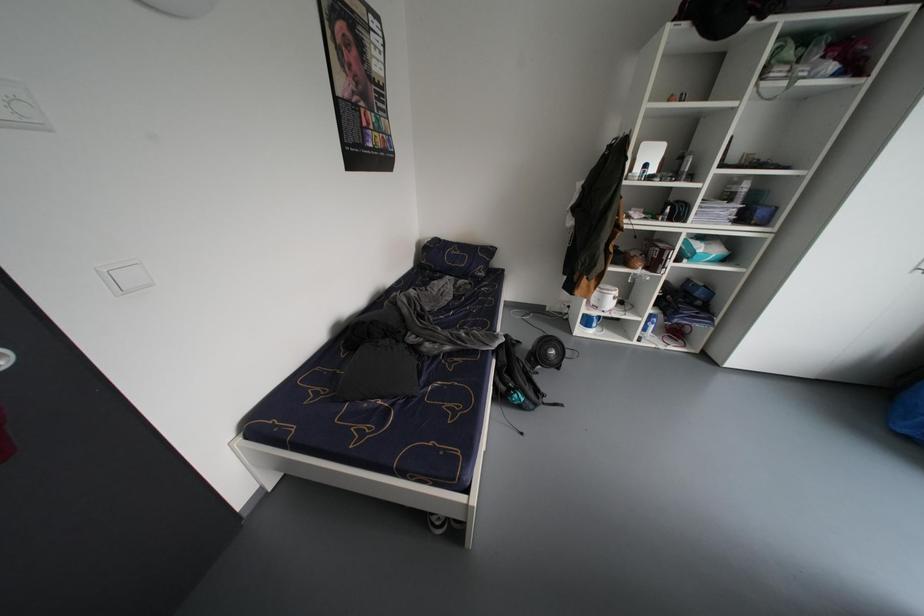
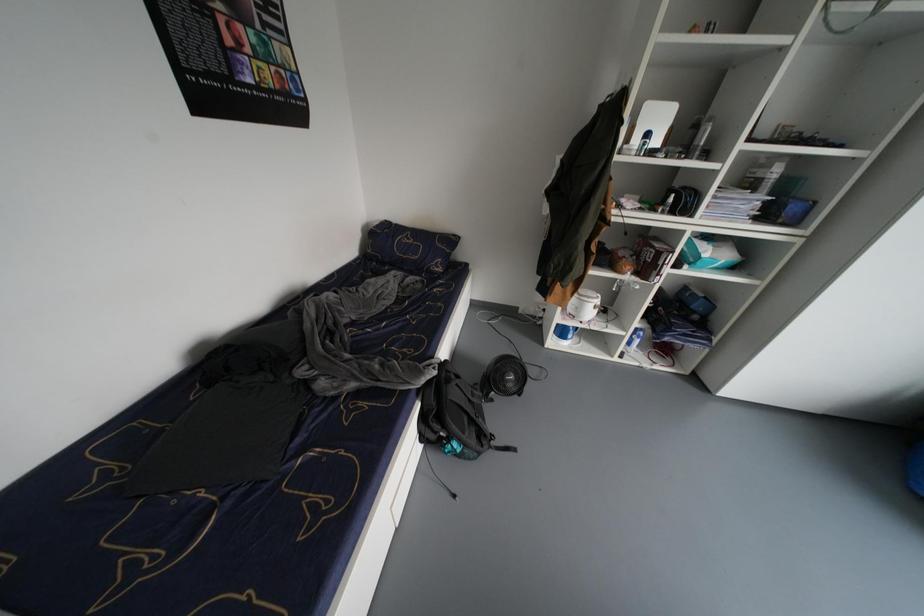
In a continuous first-person perspective shot, in which direction is the camera moving?

The movement direction of the cameraman is right, forward.